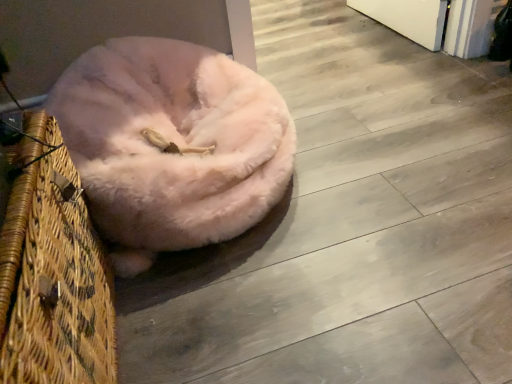
Where is `free space in front of fuzzy pink dog bed at center`? The image size is (512, 384). free space in front of fuzzy pink dog bed at center is located at coordinates (281, 312).